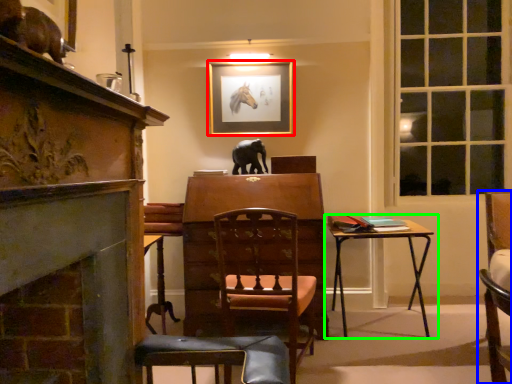
Question: Which is nearer to the picture frame (highlighted by a red box)? chair (highlighted by a blue box) or table (highlighted by a green box).

Choices:
 (A) chair
 (B) table

Answer: (B)